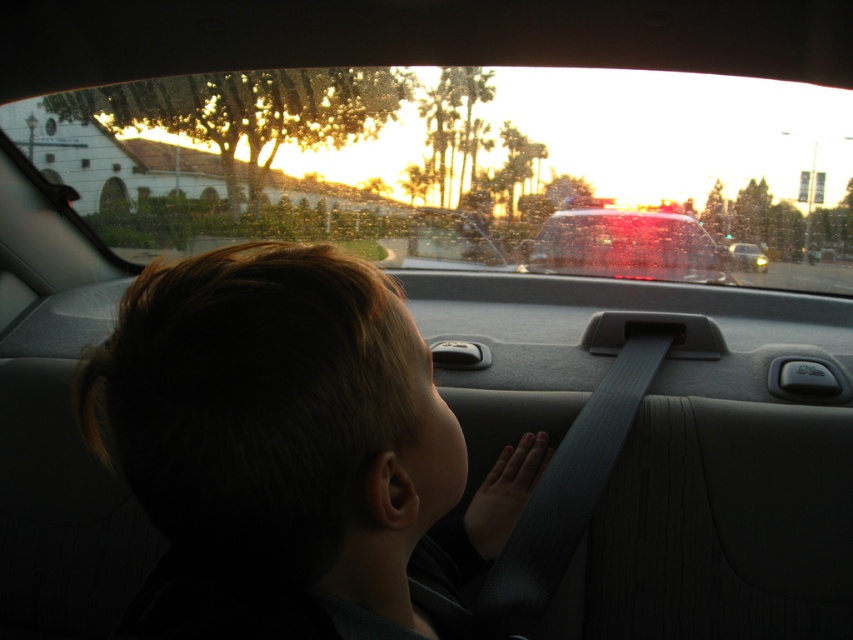
Question: Which of the following is the farthest from the observer?

Choices:
 (A) shiny metallic car at center
 (B) dark gray fabric hand at center

Answer: (A)

Question: Does transparent glass car window at upper center come behind dark hair at center?

Choices:
 (A) yes
 (B) no

Answer: (A)

Question: Among these points, which one is nearest to the camera?

Choices:
 (A) (639, 246)
 (B) (619, 132)
 (C) (727, 250)
 (D) (502, 458)

Answer: (D)

Question: Which of the following is the closest to the observer?

Choices:
 (A) (546, 125)
 (B) (494, 474)
 (C) (250, 504)
 (D) (750, 268)

Answer: (C)

Question: Can you confirm if dark hair at center is positioned to the left of matte black car at center?

Choices:
 (A) yes
 (B) no

Answer: (A)

Question: Does dark hair at center have a smaller size compared to dark gray fabric hand at center?

Choices:
 (A) no
 (B) yes

Answer: (A)